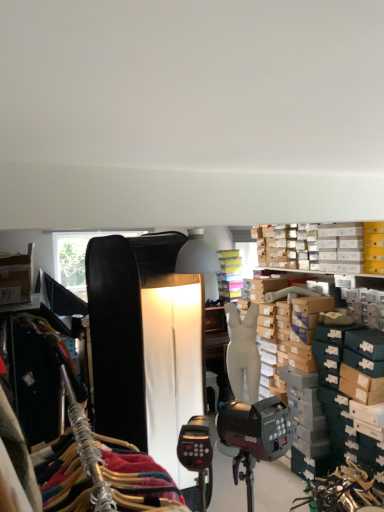
Question: Considering the positions of point (269, 251) and point (226, 372), is point (269, 251) closer or farther from the camera than point (226, 372)?

Choices:
 (A) closer
 (B) farther

Answer: (B)

Question: Looking at their shapes, would you say white cardboard boxes at upper right is wider or thinner than white matte mannequin at center?

Choices:
 (A) wide
 (B) thin

Answer: (A)

Question: From a real-world perspective, relative to white matte mannequin at center, is white cardboard boxes at upper right vertically above or below?

Choices:
 (A) below
 (B) above

Answer: (B)

Question: Considering the positions of point (256, 309) and point (294, 265), is point (256, 309) closer or farther from the camera than point (294, 265)?

Choices:
 (A) farther
 (B) closer

Answer: (B)

Question: Considering the positions of white matte mannequin at center and white cardboard boxes at upper right in the image, is white matte mannequin at center wider or thinner than white cardboard boxes at upper right?

Choices:
 (A) thin
 (B) wide

Answer: (A)

Question: In terms of size, does white matte mannequin at center appear bigger or smaller than white cardboard boxes at upper right?

Choices:
 (A) big
 (B) small

Answer: (A)

Question: From the image's perspective, is white matte mannequin at center located above or below white cardboard boxes at upper right?

Choices:
 (A) below
 (B) above

Answer: (A)